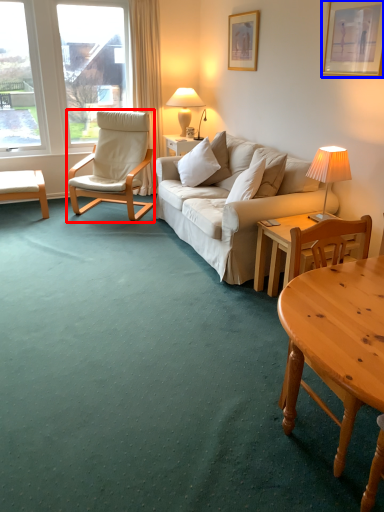
Question: Which point is further to the camera, chair (highlighted by a red box) or picture frame (highlighted by a blue box)?

Choices:
 (A) chair
 (B) picture frame

Answer: (A)